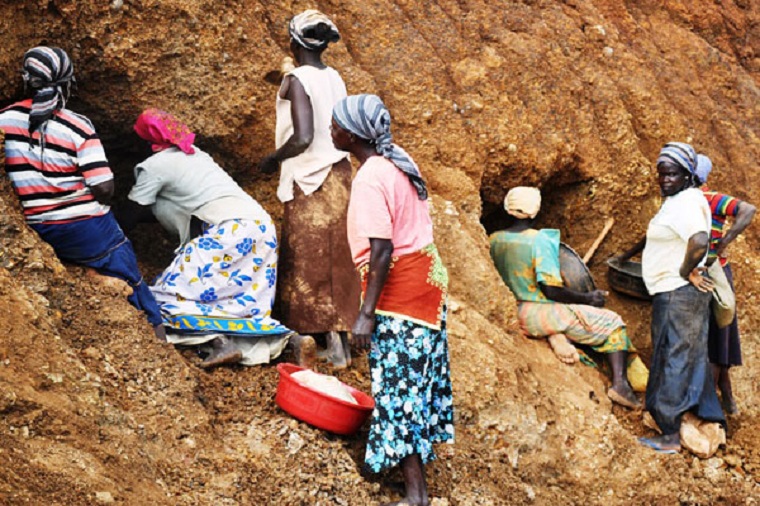
Locate an element on the screen. Image resolution: width=760 pixels, height=506 pixels. bucket is located at coordinates (568, 277), (629, 276), (344, 411).